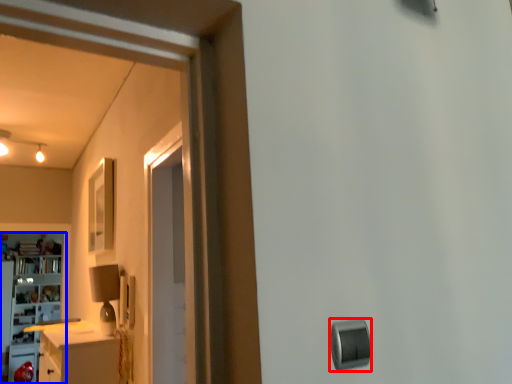
Question: Which object appears farthest to the camera in this image, knob (highlighted by a red box) or cabinetry (highlighted by a blue box)?

Choices:
 (A) knob
 (B) cabinetry

Answer: (B)